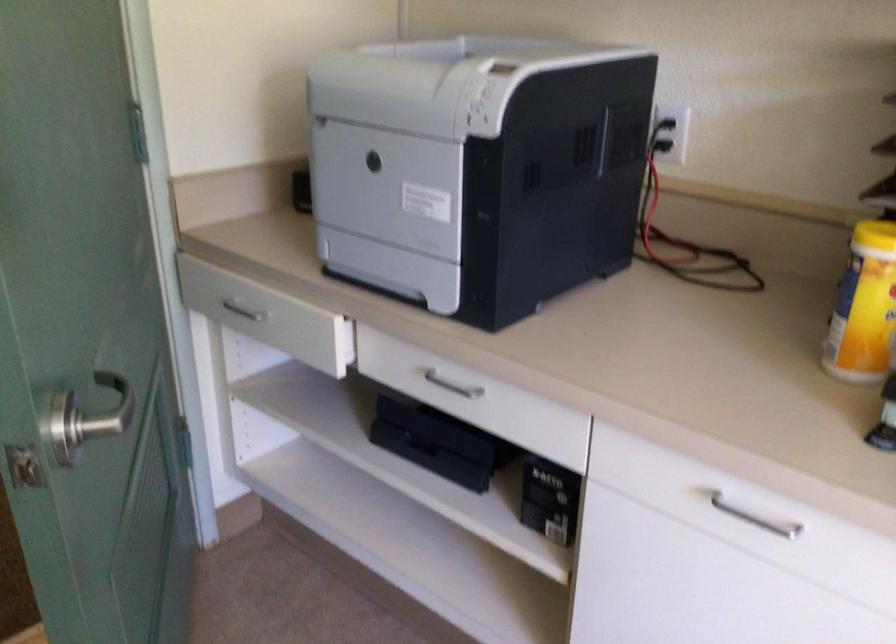
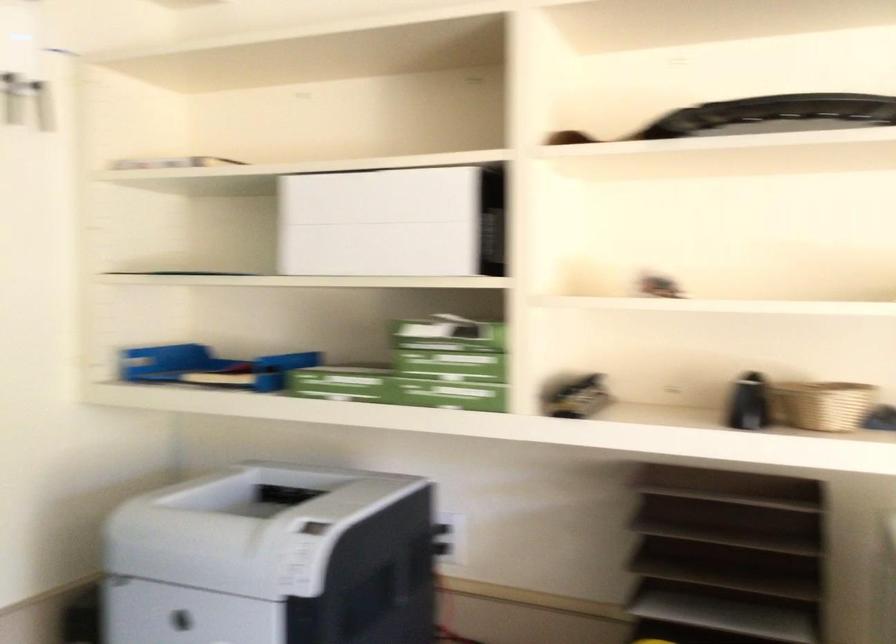
Where in the second image is the point corresponding to [435,70] from the first image?

(246, 527)